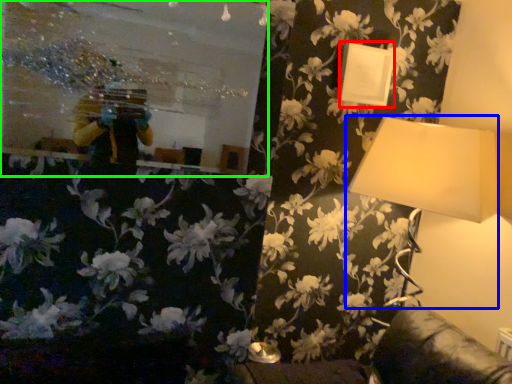
Question: Considering the real-world distances, which object is closest to picture frame (highlighted by a red box)? lamp (highlighted by a blue box) or mirror (highlighted by a green box).

Choices:
 (A) lamp
 (B) mirror

Answer: (A)